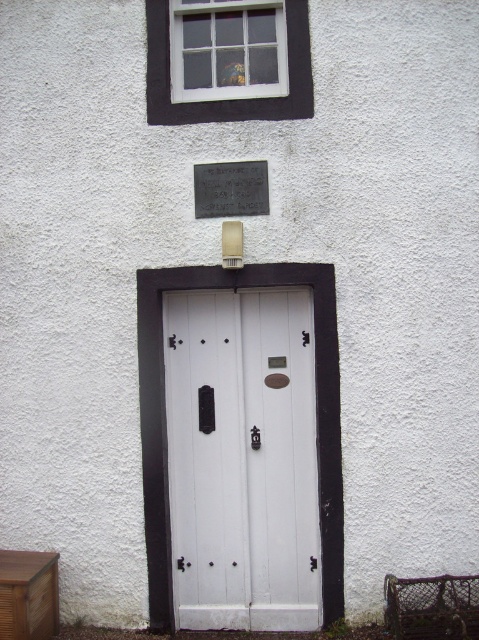
Question: Where is white wooden door at center located in relation to wooden drawer at lower left in the image?

Choices:
 (A) right
 (B) left

Answer: (A)

Question: Is white wooden window at upper center above metallic plaque at upper center?

Choices:
 (A) yes
 (B) no

Answer: (A)

Question: Estimate the real-world distances between objects in this image. Which object is closer to the white wooden door at center?

Choices:
 (A) wooden drawer at lower left
 (B) metallic plaque at upper center

Answer: (B)

Question: Is white wooden door at center wider than metallic plaque at upper center?

Choices:
 (A) no
 (B) yes

Answer: (B)

Question: Which object appears farthest from the camera in this image?

Choices:
 (A) wooden drawer at lower left
 (B) white wooden window at upper center
 (C) white wooden door at center
 (D) metallic plaque at upper center

Answer: (B)

Question: Which object is closer to the camera taking this photo?

Choices:
 (A) wooden drawer at lower left
 (B) white wooden door at center

Answer: (A)